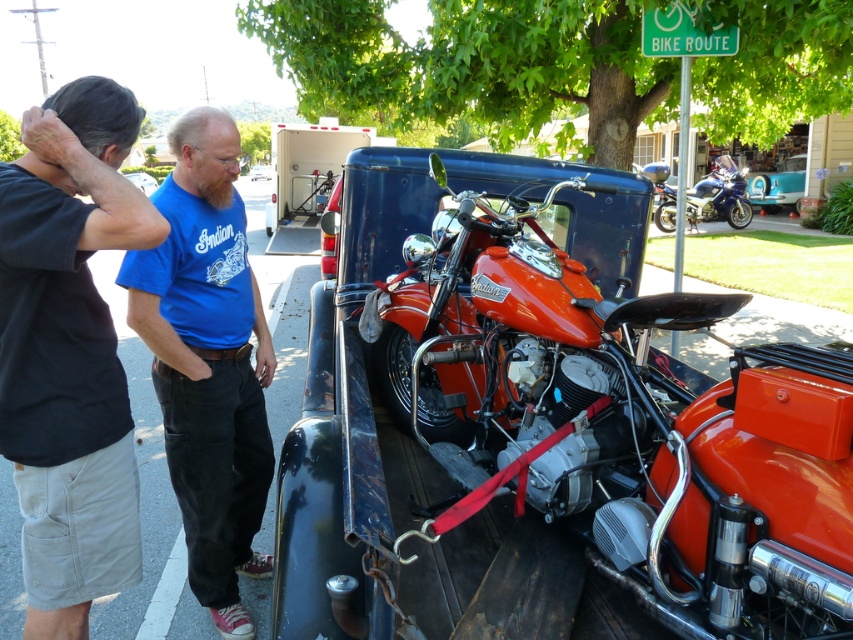
Who is more forward, (4, 284) or (187, 193)?

Point (4, 284) is more forward.

Which is above, black cotton shirt at upper left or blue cotton shirt at center?

black cotton shirt at upper left

Who is more forward, (123, 416) or (196, 342)?

Point (123, 416) is in front.

Locate an element on the screen. The height and width of the screenshot is (640, 853). black cotton shirt at upper left is located at coordinates (68, 349).

Is shiny metallic motorcycle at upper right positioned before blue cotton shirt at upper left?

Yes, it is.

Is shiny metallic motorcycle at upper right positioned behind blue cotton shirt at upper left?

That is False.

Measure the distance between point [666,200] and camera.

Point [666,200] is 18.03 meters away from camera.

Locate an element on the screen. Image resolution: width=853 pixels, height=640 pixels. shiny metallic motorcycle at upper right is located at coordinates (718, 195).

Can you confirm if blue cotton shirt at center is positioned to the right of blue cotton shirt at upper left?

Correct, you'll find blue cotton shirt at center to the right of blue cotton shirt at upper left.

Describe the element at coordinates (207, 362) in the screenshot. The height and width of the screenshot is (640, 853). I see `blue cotton shirt at center` at that location.

You are a GUI agent. You are given a task and a screenshot of the screen. Output one action in this format:
    pyautogui.click(x=<x>, y=<y>)
    Task: Click on the blue cotton shirt at center
    
    Given the screenshot: What is the action you would take?
    pyautogui.click(x=207, y=362)